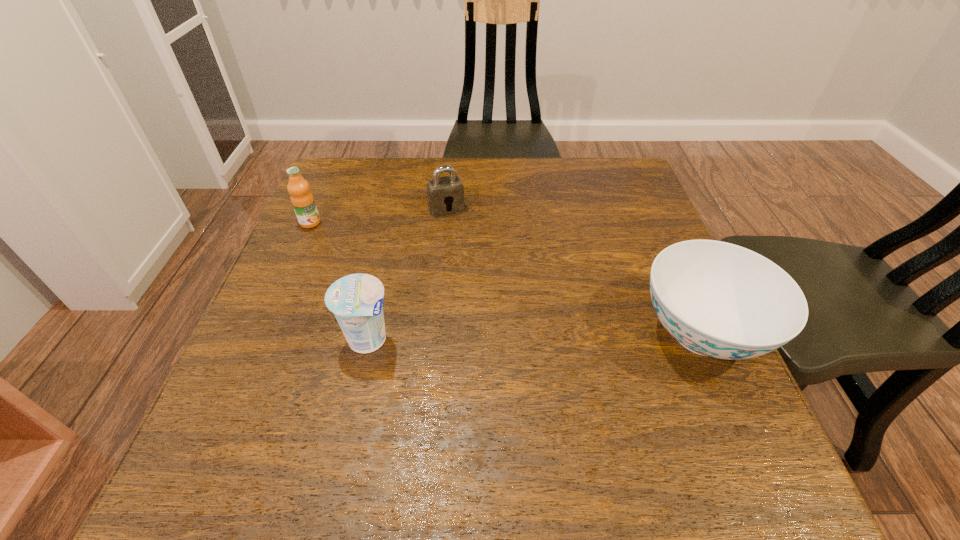
Identify which object is the third nearest to the chinaware. Please provide its 2D coordinates. Your answer should be formatted as a tuple, i.e. [(x, y)], where the tuple contains the x and y coordinates of a point satisfying the conditions above.

[(302, 199)]

At what (x,y) coordinates should I click in order to perform the action: click on object that ranks as the third closest to the yogurt. Please return your answer as a coordinate pair (x, y). The width and height of the screenshot is (960, 540). Looking at the image, I should click on (717, 299).

I want to click on free space that satisfies the following two spatial constraints: 1. on the front side of the chinaware; 2. on the right side of the orange juice, so click(262, 333).

Locate an element on the screen. The height and width of the screenshot is (540, 960). vacant space that satisfies the following two spatial constraints: 1. on the front side of the yogurt; 2. on the left side of the leftmost object is located at coordinates (259, 339).

I want to click on vacant region that satisfies the following two spatial constraints: 1. on the front side of the rightmost object; 2. on the right side of the leftmost object, so click(262, 333).

I want to click on vacant region that satisfies the following two spatial constraints: 1. on the back side of the yogurt; 2. on the right side of the second object from right to left, so click(396, 209).